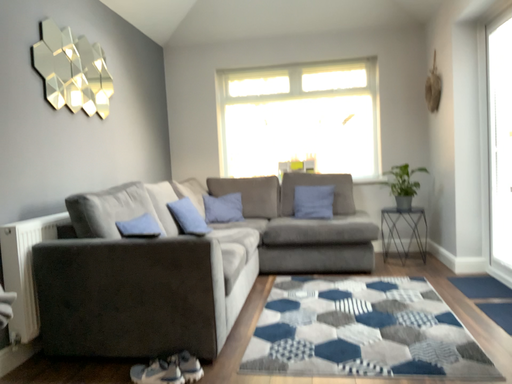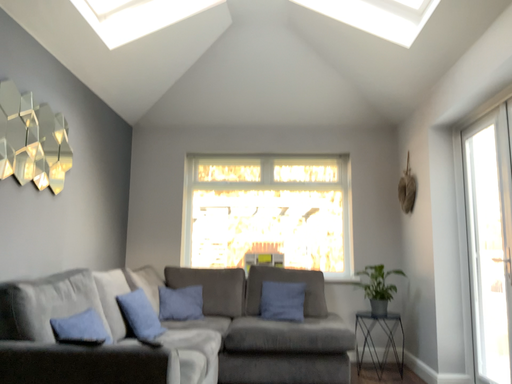
Question: How did the camera likely rotate when shooting the video?

Choices:
 (A) rotated upward
 (B) rotated downward

Answer: (A)